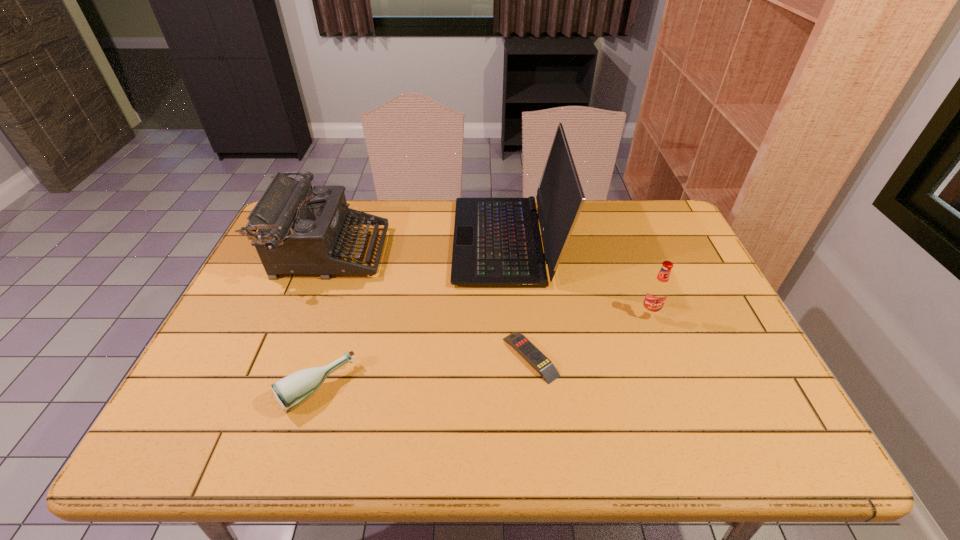
Find the location of a particular element. This screenshot has width=960, height=540. blank region between the root beer and the remote control is located at coordinates (589, 335).

Where is `vacant point located between the rightmost object and the bottle`? vacant point located between the rightmost object and the bottle is located at coordinates (483, 351).

Select which object is the second closest to the shortest object. Please provide its 2D coordinates. Your answer should be formatted as a tuple, i.e. [(x, y)], where the tuple contains the x and y coordinates of a point satisfying the conditions above.

[(657, 292)]

Find the location of `object that stands as the second closest to the typewriter`. object that stands as the second closest to the typewriter is located at coordinates (291, 391).

Locate an element on the screen. Image resolution: width=960 pixels, height=540 pixels. vacant area in the image that satisfies the following two spatial constraints: 1. on the screen of the shortest object; 2. on the left side of the tallest object is located at coordinates (515, 357).

You are a GUI agent. You are given a task and a screenshot of the screen. Output one action in this format:
    pyautogui.click(x=<x>, y=<y>)
    Task: Click on the vacant space that satisfies the following two spatial constraints: 1. on the typing side of the second tallest object; 2. on the back side of the second shortest object
    The width and height of the screenshot is (960, 540).
    Given the screenshot: What is the action you would take?
    pyautogui.click(x=276, y=388)

Locate an element on the screen. free spot that satisfies the following two spatial constraints: 1. on the typing side of the shortest object; 2. on the right side of the fourth shortest object is located at coordinates (288, 357).

Where is `free spot that satisfies the following two spatial constraints: 1. on the typing side of the second tallest object; 2. on the right side of the third nearest object`? free spot that satisfies the following two spatial constraints: 1. on the typing side of the second tallest object; 2. on the right side of the third nearest object is located at coordinates (304, 314).

This screenshot has width=960, height=540. I want to click on vacant space that satisfies the following two spatial constraints: 1. on the back side of the shortest object; 2. on the screen of the laptop computer, so click(x=518, y=241).

Identify the location of vacant area that satisfies the following two spatial constraints: 1. on the typing side of the rightmost object; 2. on the right side of the typewriter. (304, 314).